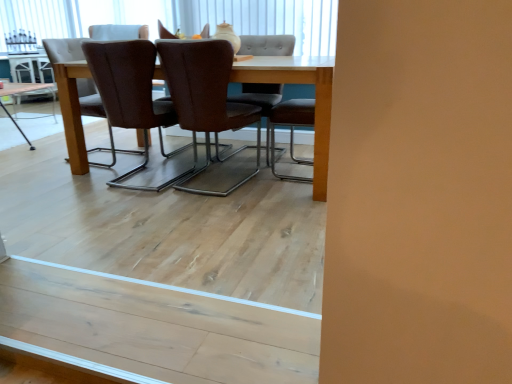
Question: Considering the positions of white leather chair at upper center, the first chair in the back-to-front sequence, and brown leather chair at center, which appears as the 3th chair when viewed from the front, in the image, is white leather chair at upper center, the first chair in the back-to-front sequence, wider or thinner than brown leather chair at center, which appears as the 3th chair when viewed from the front,?

Choices:
 (A) thin
 (B) wide

Answer: (B)

Question: Is point (105, 34) positioned closer to the camera than point (263, 48)?

Choices:
 (A) closer
 (B) farther

Answer: (A)

Question: Which object is positioned closest to the brown leather chair at center, acting as the 2th chair starting from the front?

Choices:
 (A) brown leather chair at center, the fifth chair positioned from the back
 (B) brown leather chair at center, which is the fourth chair in front-to-back order
 (C) light wood table at center, the second table when ordered from bottom to top
 (D) light wood table at center, which is the first table in front-to-back order
 (E) white leather chair at upper center, the 5th chair when ordered from front to back

Answer: (A)

Question: Based on their relative distances, which object is nearer to the white leather chair at upper center, the 5th chair when ordered from front to back?

Choices:
 (A) light wood table at center, which is the first table in front-to-back order
 (B) light wood table at center, the second table when ordered from bottom to top
 (C) brown leather chair at center, which is the fourth chair in front-to-back order
 (D) brown leather chair at center, which appears as the 3th chair when viewed from the front
 (E) brown leather chair at center, acting as the 4th chair starting from the back

Answer: (E)